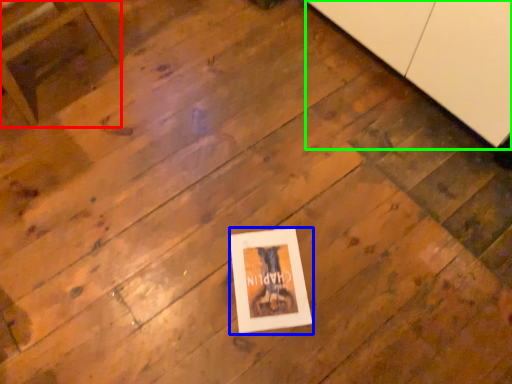
Question: Which is nearer to the furniture (highlighted by a red box)? picture frame (highlighted by a blue box) or cabinetry (highlighted by a green box).

Choices:
 (A) picture frame
 (B) cabinetry

Answer: (A)